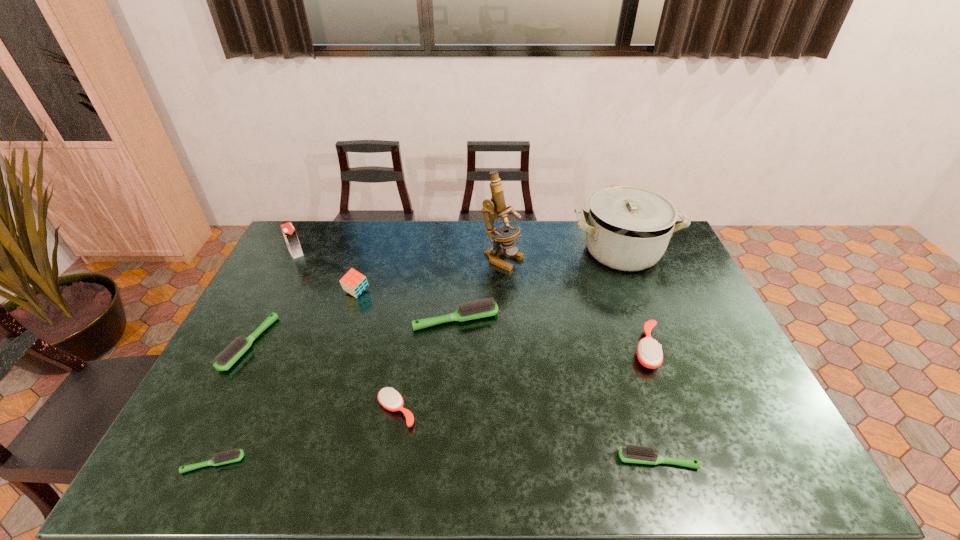
Identify the location of orange juice located at the left edge. The height and width of the screenshot is (540, 960). (289, 232).

At what (x,y) coordinates should I click in order to perform the action: click on object present at the right edge. Please return your answer as a coordinate pair (x, y). This screenshot has height=540, width=960. Looking at the image, I should click on (628, 227).

Find the location of `object that is positioned at the far left corner`. object that is positioned at the far left corner is located at coordinates (289, 232).

Where is `object that is positioned at the near left corner`? The image size is (960, 540). object that is positioned at the near left corner is located at coordinates coord(229,456).

The width and height of the screenshot is (960, 540). Identify the location of object at the far right corner. (628, 227).

You are a GUI agent. You are given a task and a screenshot of the screen. Output one action in this format:
    pyautogui.click(x=<x>, y=<y>)
    Task: Click on the vacant space at the far edge of the desktop
    The width and height of the screenshot is (960, 540).
    Given the screenshot: What is the action you would take?
    pyautogui.click(x=586, y=251)

This screenshot has height=540, width=960. I want to click on vacant area at the near edge, so click(585, 479).

Locate an element on the screen. This screenshot has height=540, width=960. vacant space at the left edge of the desktop is located at coordinates (255, 408).

Find the location of `free space at the right edge`. free space at the right edge is located at coordinates (696, 356).

You are a GUI agent. You are given a task and a screenshot of the screen. Output one action in this format:
    pyautogui.click(x=<x>, y=<y>)
    Task: Click on the free space at the far left corner of the desktop
    
    Given the screenshot: What is the action you would take?
    pyautogui.click(x=310, y=242)